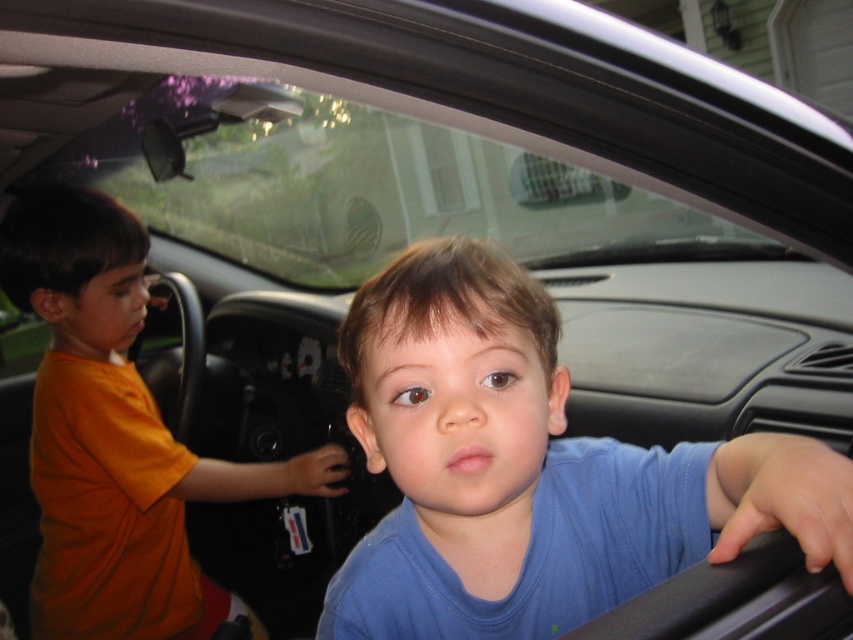
Question: Does blue matte shirt at center appear on the left side of transparent glass car window at upper center?

Choices:
 (A) no
 (B) yes

Answer: (A)

Question: Among these points, which one is nearest to the camera?

Choices:
 (A) (86, 406)
 (B) (424, 442)

Answer: (B)

Question: Which of the following is the farthest from the observer?

Choices:
 (A) blue matte shirt at center
 (B) orange cotton shirt at left
 (C) transparent glass car window at upper center

Answer: (B)

Question: Which of the following is the farthest from the observer?

Choices:
 (A) orange cotton shirt at left
 (B) blue matte shirt at center

Answer: (A)

Question: Does transparent glass car window at upper center come behind orange cotton shirt at left?

Choices:
 (A) no
 (B) yes

Answer: (A)

Question: Is blue matte shirt at center wider than transparent glass car window at upper center?

Choices:
 (A) no
 (B) yes

Answer: (A)